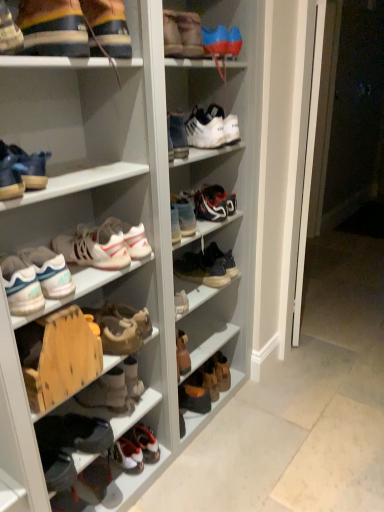
What do you see at coordinates (202, 269) in the screenshot? I see `leather sneaker at center, the 10th footwear positioned from the top` at bounding box center [202, 269].

Measure the distance between leather sneaker at center, the 10th footwear positioned from the top, and camera.

They are 5.89 feet apart.

Find the location of a particular element. Image resolution: width=384 pixels, height=512 pixels. white matte sneakers at center, the 7th footwear in the top-to-bottom sequence is located at coordinates (131, 237).

Measure the distance between leather boot at lower center, which is counted as the 1th footwear, starting from the bottom, and camera.

They are 6.32 feet apart.

How much space does matte blue shoe at left, placed as the ninth footwear when sorted from bottom to top, occupy vertically?

12.19 centimeters.

Identify the location of leather sneaker at center, the 5th footwear positioned from the bottom. This screenshot has width=384, height=512. (202, 269).

Does matte blue shoe at left, placed as the ninth footwear when sorted from bottom to top, have a lesser height compared to leather sneaker at center, the 5th footwear positioned from the bottom?

Indeed, matte blue shoe at left, placed as the ninth footwear when sorted from bottom to top, has a lesser height compared to leather sneaker at center, the 5th footwear positioned from the bottom.

Is matte blue shoe at left, the sixth footwear from the top, in front of or behind leather sneaker at center, the 10th footwear positioned from the top, in the image?

Visually, matte blue shoe at left, the sixth footwear from the top, is located in front of leather sneaker at center, the 10th footwear positioned from the top.

How much distance is there between matte blue shoe at left, the sixth footwear from the top, and leather sneaker at center, the 10th footwear positioned from the top?

A distance of 97.43 centimeters exists between matte blue shoe at left, the sixth footwear from the top, and leather sneaker at center, the 10th footwear positioned from the top.

Is matte blue shoe at left, the sixth footwear from the top, aimed at leather sneaker at center, the 5th footwear positioned from the bottom?

No, matte blue shoe at left, the sixth footwear from the top, is not aimed at leather sneaker at center, the 5th footwear positioned from the bottom.

Which footwear is the 2nd one when counting from the right side of the shiny blue sneakers at center, acting as the tenth footwear starting from the bottom? Please provide its 2D coordinates.

[(225, 123)]

Between shiny blue sneakers at center, marked as the fifth footwear in a top-to-bottom arrangement, and white matte sneaker at upper center, the 2th footwear viewed from the top, which one has more height?

white matte sneaker at upper center, the 2th footwear viewed from the top, is taller.

Is shiny blue sneakers at center, marked as the fifth footwear in a top-to-bottom arrangement, positioned far away from white matte sneaker at upper center, the 2th footwear viewed from the top?

shiny blue sneakers at center, marked as the fifth footwear in a top-to-bottom arrangement, is actually quite close to white matte sneaker at upper center, the 2th footwear viewed from the top.

Is white matte sneaker at center, the third footwear from the top, situated inside shiny blue sneakers at center, acting as the tenth footwear starting from the bottom, or outside?

white matte sneaker at center, the third footwear from the top, is not enclosed by shiny blue sneakers at center, acting as the tenth footwear starting from the bottom.

From a real-world perspective, is white matte sneaker at center, which ranks as the 12th footwear in bottom-to-top order, over shiny blue sneakers at center, acting as the tenth footwear starting from the bottom?

Indeed, from a real-world perspective, white matte sneaker at center, which ranks as the 12th footwear in bottom-to-top order, stands above shiny blue sneakers at center, acting as the tenth footwear starting from the bottom.

Considering the sizes of white matte sneaker at center, the third footwear from the top, and shiny blue sneakers at center, acting as the tenth footwear starting from the bottom, in the image, is white matte sneaker at center, the third footwear from the top, taller or shorter than shiny blue sneakers at center, acting as the tenth footwear starting from the bottom,?

In the image, white matte sneaker at center, the third footwear from the top, appears to be taller than shiny blue sneakers at center, acting as the tenth footwear starting from the bottom.

From the image's perspective, is white matte sneaker at center, the third footwear from the top, positioned above or below shiny blue sneakers at center, marked as the fifth footwear in a top-to-bottom arrangement?

white matte sneaker at center, the third footwear from the top, is situated higher than shiny blue sneakers at center, marked as the fifth footwear in a top-to-bottom arrangement, in the image.

Is brown suede boot at lower center, acting as the thirteenth footwear starting from the top, positioned with its back to matte blue shoe at left, placed as the ninth footwear when sorted from bottom to top?

No, brown suede boot at lower center, acting as the thirteenth footwear starting from the top, is not facing away from matte blue shoe at left, placed as the ninth footwear when sorted from bottom to top.

Image resolution: width=384 pixels, height=512 pixels. I want to click on the 13th footwear in front of the brown suede boot at lower center, acting as the thirteenth footwear starting from the top, starting your count from the anchor, so click(x=10, y=174).

Is brown suede boot at lower center, acting as the thirteenth footwear starting from the top, not inside matte blue shoe at left, the sixth footwear from the top?

Yes.

Is brown suede boots at center, which is the twelfth footwear in top-to-bottom order, next to matte blue shoe at left, the sixth footwear from the top?

brown suede boots at center, which is the twelfth footwear in top-to-bottom order, and matte blue shoe at left, the sixth footwear from the top, are clearly separated.

Would you say brown suede boots at center, arranged as the third footwear when ordered from the bottom, is to the left or to the right of matte blue shoe at left, placed as the ninth footwear when sorted from bottom to top, in the picture?

Clearly, brown suede boots at center, arranged as the third footwear when ordered from the bottom, is on the right of matte blue shoe at left, placed as the ninth footwear when sorted from bottom to top, in the image.

Is brown suede boots at center, arranged as the third footwear when ordered from the bottom, taller than matte blue shoe at left, placed as the ninth footwear when sorted from bottom to top?

Correct, brown suede boots at center, arranged as the third footwear when ordered from the bottom, is much taller as matte blue shoe at left, placed as the ninth footwear when sorted from bottom to top.

Which of these two, brown suede boots at center, arranged as the third footwear when ordered from the bottom, or matte blue shoe at left, placed as the ninth footwear when sorted from bottom to top, is smaller?

With smaller size is matte blue shoe at left, placed as the ninth footwear when sorted from bottom to top.

Does white matte sneakers at left, acting as the 11th footwear starting from the top, turn towards matte blue sneakers at upper left, acting as the 4th footwear starting from the top?

No, white matte sneakers at left, acting as the 11th footwear starting from the top, is not facing towards matte blue sneakers at upper left, acting as the 4th footwear starting from the top.

Locate an element on the screen. the 2nd footwear counting from the left of the matte blue sneakers at upper left, which is the 11th footwear in bottom-to-top order is located at coordinates (35, 279).

Which is behind, point (3, 270) or point (36, 183)?

The point (3, 270) is more distant.

Can you confirm if white matte sneakers at left, acting as the 11th footwear starting from the top, is smaller than matte blue sneakers at upper left, which is the 11th footwear in bottom-to-top order?

Actually, white matte sneakers at left, acting as the 11th footwear starting from the top, might be larger than matte blue sneakers at upper left, which is the 11th footwear in bottom-to-top order.

Could you tell me if matte black sneaker at upper left, acting as the first footwear starting from the top, is turned towards brown suede boots at center, arranged as the third footwear when ordered from the bottom?

No, matte black sneaker at upper left, acting as the first footwear starting from the top, does not turn towards brown suede boots at center, arranged as the third footwear when ordered from the bottom.

What's the angular difference between matte black sneaker at upper left, marked as the 14th footwear in a bottom-to-top arrangement, and brown suede boots at center, arranged as the third footwear when ordered from the bottom,'s facing directions?

The angular difference between matte black sneaker at upper left, marked as the 14th footwear in a bottom-to-top arrangement, and brown suede boots at center, arranged as the third footwear when ordered from the bottom, is 11.4 degrees.

Measure the distance from matte black sneaker at upper left, acting as the first footwear starting from the top, to brown suede boots at center, arranged as the third footwear when ordered from the bottom.

A distance of 1.11 meters exists between matte black sneaker at upper left, acting as the first footwear starting from the top, and brown suede boots at center, arranged as the third footwear when ordered from the bottom.

Considering the sizes of objects matte black sneaker at upper left, acting as the first footwear starting from the top, and brown suede boots at center, arranged as the third footwear when ordered from the bottom, in the image provided, who is wider, matte black sneaker at upper left, acting as the first footwear starting from the top, or brown suede boots at center, arranged as the third footwear when ordered from the bottom,?

With larger width is brown suede boots at center, arranged as the third footwear when ordered from the bottom.

Locate an element on the screen. The image size is (384, 512). the 4th footwear below when counting from the matte blue shoe at left, the sixth footwear from the top (from the image's perspective) is located at coordinates (202, 269).

In order to click on the 2nd footwear counting from the right side of the shiny blue sneakers at center, marked as the fifth footwear in a top-to-bottom arrangement in this screenshot , I will do `click(225, 123)`.

Which object lies nearer to the anchor point leather boot at lower center, which is counted as the 1th footwear, starting from the bottom, matte blue sneakers at upper left, acting as the 4th footwear starting from the top, or white matte sneakers at center, which is the eighth footwear in bottom-to-top order?

white matte sneakers at center, which is the eighth footwear in bottom-to-top order, lies closer to leather boot at lower center, which is counted as the 1th footwear, starting from the bottom, than the other object.

Which object lies nearer to the anchor point white matte sneaker at upper center, the 2th footwear viewed from the top, matte blue sneakers at upper left, which is the 11th footwear in bottom-to-top order, or white matte sneakers at left, acting as the 11th footwear starting from the top?

Based on the image, matte blue sneakers at upper left, which is the 11th footwear in bottom-to-top order, appears to be nearer to white matte sneaker at upper center, the 2th footwear viewed from the top.

Based on their spatial positions, is white matte sneaker at upper center, which is the thirteenth footwear from bottom to top, or brown suede boot at lower center, which ranks as the second footwear in bottom-to-top order, closer to leather sneaker at center, the 5th footwear positioned from the bottom?

brown suede boot at lower center, which ranks as the second footwear in bottom-to-top order, lies closer to leather sneaker at center, the 5th footwear positioned from the bottom, than the other object.

Considering their positions, is matte black sneaker at center, acting as the 6th footwear starting from the bottom, positioned further to shiny blue sneakers at center, acting as the tenth footwear starting from the bottom, than brown suede boots at center, which is the twelfth footwear in top-to-bottom order?

The object further to shiny blue sneakers at center, acting as the tenth footwear starting from the bottom, is brown suede boots at center, which is the twelfth footwear in top-to-bottom order.

Which object lies further to the anchor point white matte sneakers at center, the 7th footwear in the top-to-bottom sequence, leather boot at lower center, which is counted as the fourteenth footwear, starting from the top, or brown suede boot at lower center, which ranks as the second footwear in bottom-to-top order?

leather boot at lower center, which is counted as the fourteenth footwear, starting from the top, is further to white matte sneakers at center, the 7th footwear in the top-to-bottom sequence.

Looking at this image, from the image, which object appears to be nearer to leather sneaker at center, the 10th footwear positioned from the top, white matte sneaker at center, which ranks as the 12th footwear in bottom-to-top order, or brown suede boot at lower center, acting as the thirteenth footwear starting from the top?

Based on the image, brown suede boot at lower center, acting as the thirteenth footwear starting from the top, appears to be nearer to leather sneaker at center, the 10th footwear positioned from the top.

Which object lies nearer to the anchor point white matte sneakers at center, which is the eighth footwear in bottom-to-top order, matte blue shoe at left, the sixth footwear from the top, or white matte sneaker at center, the third footwear from the top?

Among the two, matte blue shoe at left, the sixth footwear from the top, is located nearer to white matte sneakers at center, which is the eighth footwear in bottom-to-top order.

Based on their spatial positions, is white matte sneakers at left, positioned as the fourth footwear in bottom-to-top order, or leather boot at lower center, which is counted as the 1th footwear, starting from the bottom, closer to white matte sneaker at upper center, which is the thirteenth footwear from bottom to top?

white matte sneakers at left, positioned as the fourth footwear in bottom-to-top order, is closer to white matte sneaker at upper center, which is the thirteenth footwear from bottom to top.

The image size is (384, 512). Identify the location of footwear between white matte sneakers at left, positioned as the fourth footwear in bottom-to-top order, and white matte sneakers at center, which is the eighth footwear in bottom-to-top order, from front to back. (93, 248).